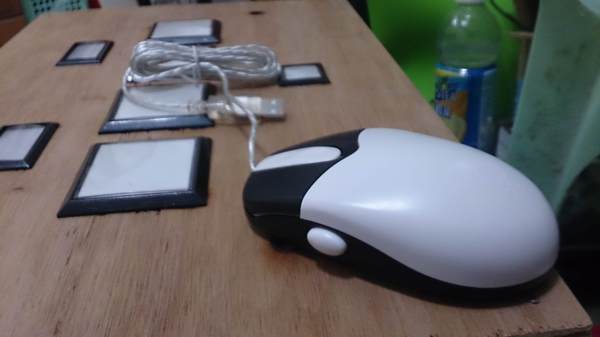
You are a GUI agent. You are given a task and a screenshot of the screen. Output one action in this format:
    pyautogui.click(x=<x>, y=<y>)
    Task: Click on the blue base of what looks like a gumball machine
    
    Given the screenshot: What is the action you would take?
    pyautogui.click(x=474, y=102)